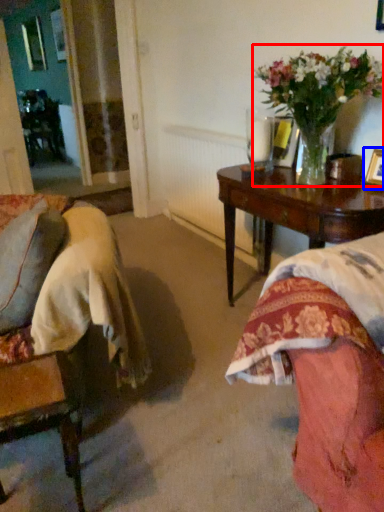
Question: Among these objects, which one is nearest to the camera, houseplant (highlighted by a red box) or picture frame (highlighted by a blue box)?

Choices:
 (A) houseplant
 (B) picture frame

Answer: (A)